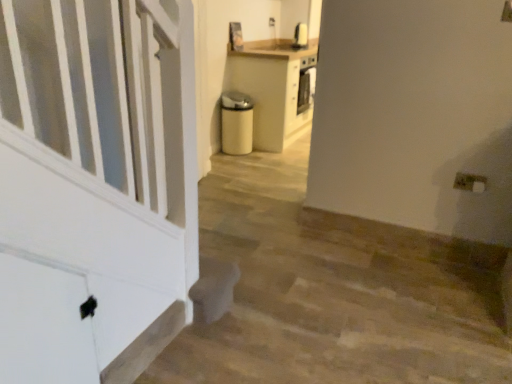
Question: Can white plastic electric outlet at lower right be found inside white matte stairwell at lower left?

Choices:
 (A) yes
 (B) no

Answer: (B)

Question: Is white matte stairwell at lower left closer to the viewer compared to white plastic electric outlet at lower right?

Choices:
 (A) yes
 (B) no

Answer: (A)

Question: Is white matte stairwell at lower left thinner than white plastic electric outlet at lower right?

Choices:
 (A) yes
 (B) no

Answer: (A)

Question: From a real-world perspective, is white matte stairwell at lower left on white plastic electric outlet at lower right?

Choices:
 (A) no
 (B) yes

Answer: (A)

Question: Is white matte stairwell at lower left aimed at white plastic electric outlet at lower right?

Choices:
 (A) yes
 (B) no

Answer: (B)

Question: From a real-world perspective, is white matte stairwell at lower left under white plastic electric outlet at lower right?

Choices:
 (A) no
 (B) yes

Answer: (B)

Question: From a real-world perspective, is white plastic electric outlet at lower right physically below white matte stairwell at lower left?

Choices:
 (A) no
 (B) yes

Answer: (A)

Question: Could white matte stairwell at lower left be considered to be inside white plastic electric outlet at lower right?

Choices:
 (A) no
 (B) yes

Answer: (A)

Question: Considering the relative sizes of white plastic electric outlet at lower right and white matte stairwell at lower left in the image provided, is white plastic electric outlet at lower right bigger than white matte stairwell at lower left?

Choices:
 (A) no
 (B) yes

Answer: (A)

Question: Does white plastic electric outlet at lower right lie behind white matte stairwell at lower left?

Choices:
 (A) yes
 (B) no

Answer: (A)

Question: Is white plastic electric outlet at lower right taller than white matte stairwell at lower left?

Choices:
 (A) no
 (B) yes

Answer: (A)

Question: Can you confirm if white plastic electric outlet at lower right is wider than white matte stairwell at lower left?

Choices:
 (A) yes
 (B) no

Answer: (A)

Question: In the image, is white plastic electric outlet at lower right positioned in front of or behind white matte stairwell at lower left?

Choices:
 (A) behind
 (B) front

Answer: (A)